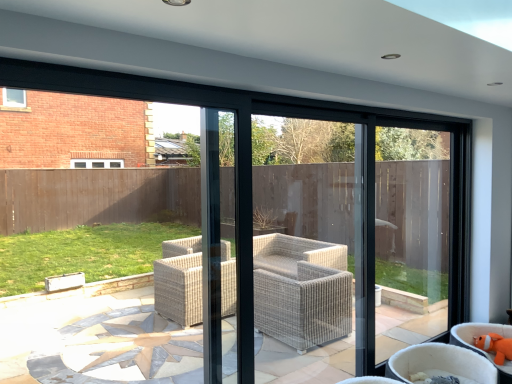
Question: From a real-world perspective, is orange plush toy at lower right, positioned as the 1th chair in right-to-left order, below beige wicker chair at lower right, which is counted as the 1th chair, starting from the left?

Choices:
 (A) yes
 (B) no

Answer: (B)

Question: From a real-world perspective, is orange plush toy at lower right, positioned as the 1th chair in right-to-left order, located higher than beige wicker chair at lower right, which ranks as the second chair in right-to-left order?

Choices:
 (A) yes
 (B) no

Answer: (A)

Question: Is orange plush toy at lower right, positioned as the 1th chair in right-to-left order, thinner than beige wicker chair at lower right, which ranks as the second chair in right-to-left order?

Choices:
 (A) yes
 (B) no

Answer: (B)

Question: Is orange plush toy at lower right, positioned as the 1th chair in right-to-left order, at the right side of beige wicker chair at lower right, which ranks as the second chair in right-to-left order?

Choices:
 (A) no
 (B) yes

Answer: (B)

Question: From the image's perspective, is orange plush toy at lower right, which is the 2th chair from left to right, located beneath beige wicker chair at lower right, which ranks as the second chair in right-to-left order?

Choices:
 (A) yes
 (B) no

Answer: (B)

Question: Is orange plush toy at lower right situated inside orange plush toy at lower right, which is the 2th chair from left to right, or outside?

Choices:
 (A) inside
 (B) outside

Answer: (A)

Question: Does point (502, 339) appear closer or farther from the camera than point (506, 336)?

Choices:
 (A) closer
 (B) farther

Answer: (A)

Question: Is orange plush toy at lower right bigger or smaller than orange plush toy at lower right, which is the 2th chair from left to right?

Choices:
 (A) big
 (B) small

Answer: (B)

Question: Is orange plush toy at lower right to the left or to the right of orange plush toy at lower right, positioned as the 1th chair in right-to-left order, in the image?

Choices:
 (A) left
 (B) right

Answer: (B)

Question: Relative to beige wicker chair at lower right, which ranks as the second chair in right-to-left order, is orange plush toy at lower right in front or behind?

Choices:
 (A) front
 (B) behind

Answer: (B)

Question: Is point (509, 347) closer or farther from the camera than point (443, 354)?

Choices:
 (A) closer
 (B) farther

Answer: (B)

Question: From the image's perspective, is orange plush toy at lower right positioned above or below beige wicker chair at lower right, which ranks as the second chair in right-to-left order?

Choices:
 (A) below
 (B) above

Answer: (B)

Question: From a real-world perspective, is orange plush toy at lower right above or below beige wicker chair at lower right, which ranks as the second chair in right-to-left order?

Choices:
 (A) above
 (B) below

Answer: (A)

Question: Is orange plush toy at lower right, which is the 2th chair from left to right, wider or thinner than orange plush toy at lower right?

Choices:
 (A) thin
 (B) wide

Answer: (B)

Question: Considering the positions of point (464, 336) and point (499, 360), is point (464, 336) closer or farther from the camera than point (499, 360)?

Choices:
 (A) closer
 (B) farther

Answer: (B)